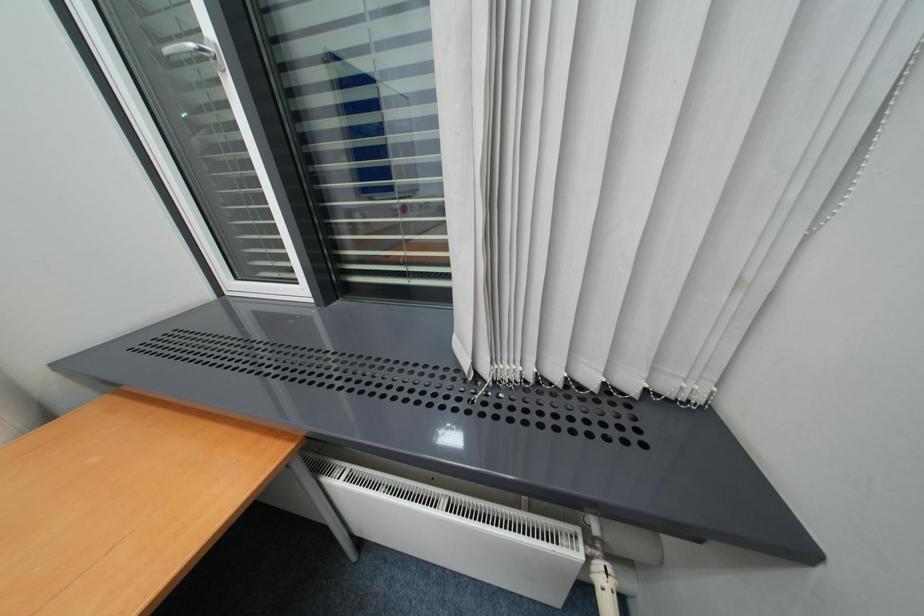
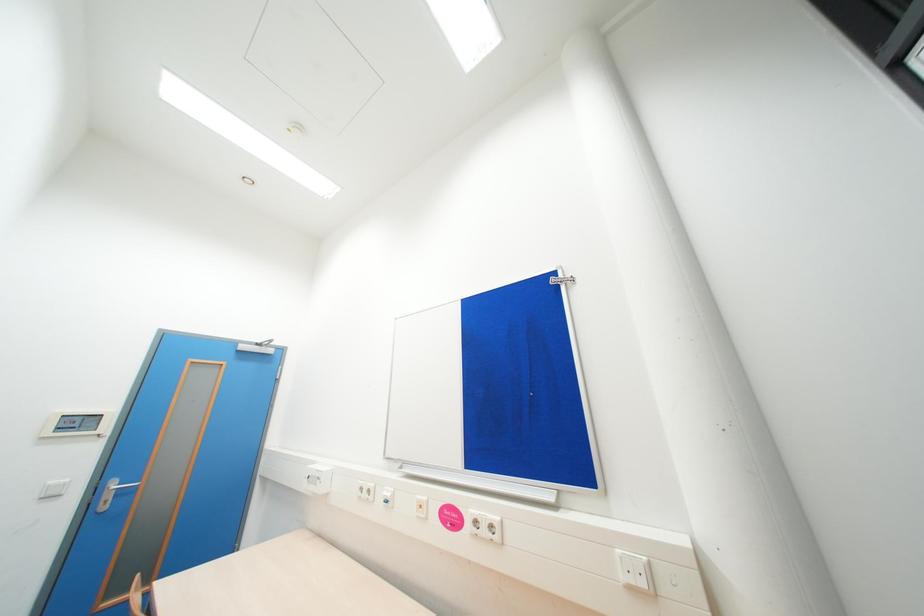
Question: Based on the continuous images, in which direction is the camera rotating? Reply with the corresponding letter.

Choices:
 (A) Left
 (B) Right
 (C) Up
 (D) Down

Answer: (A)